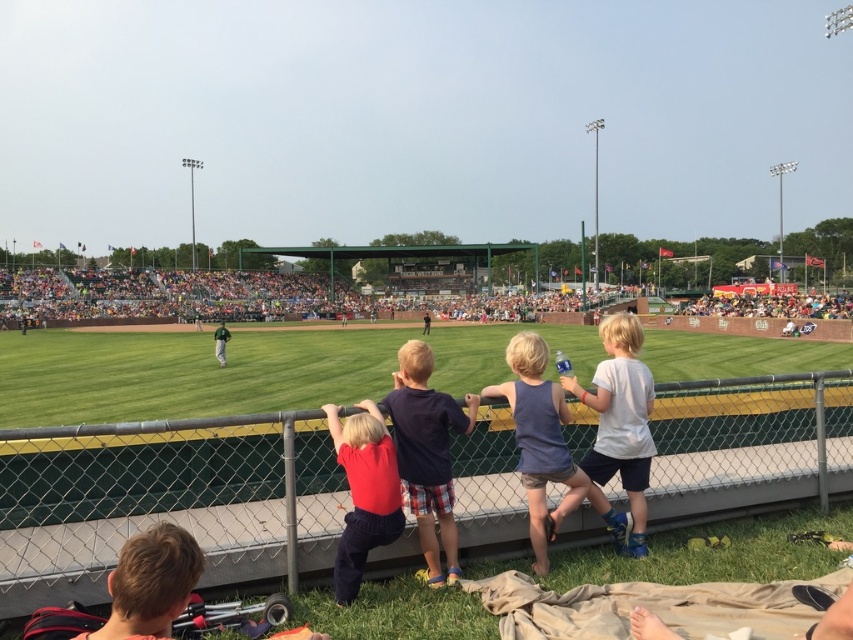
Question: In this image, where is dark blue t-shirt at center located relative to matte red shirt at center?

Choices:
 (A) below
 (B) above

Answer: (B)

Question: Among these objects, which one is nearest to the camera?

Choices:
 (A) blue cotton tank top at center
 (B) dark blue t-shirt at center

Answer: (B)

Question: Where is green grass baseball field at center located in relation to blonde hair at lower left in the image?

Choices:
 (A) below
 (B) above

Answer: (B)

Question: Which point is closer to the camera?

Choices:
 (A) (436, 564)
 (B) (120, 564)
 (C) (59, 284)

Answer: (B)

Question: Which object is closer to the camera taking this photo?

Choices:
 (A) dark blue t-shirt at center
 (B) white cotton shirt at center
 (C) blonde hair at lower left
 (D) blue cotton tank top at center

Answer: (C)

Question: Where is white cotton shirt at center located in relation to blonde hair at lower left in the image?

Choices:
 (A) below
 (B) above

Answer: (B)